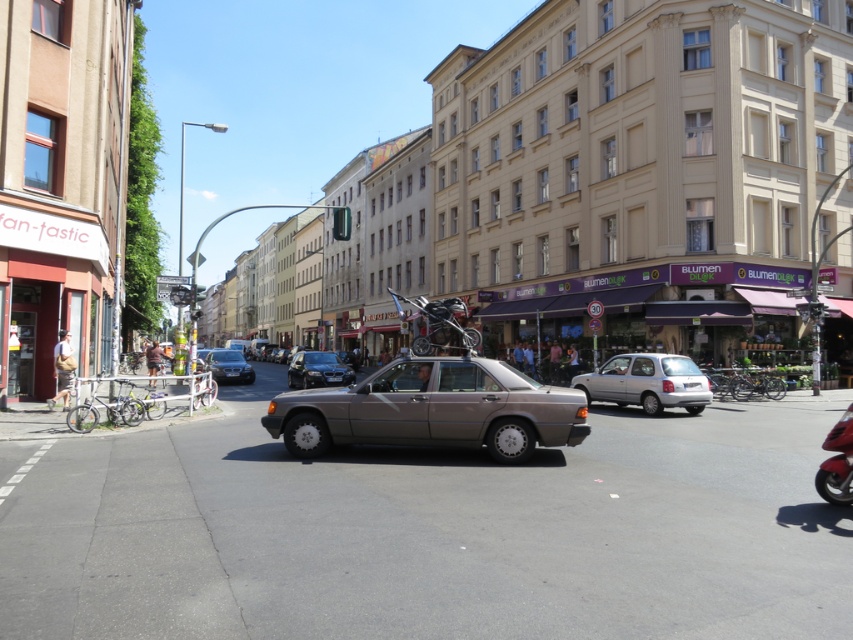
You are a delivery driver needing to park your satin silver car at center near the sidewalk on the left. Based on the scene, can you safely park the car there without blocking the sidewalk or the road?

The satin silver car at center is located at point (432, 410), which is in the center of the road. Parking there would block the road, so it is not safe to park the car there near the sidewalk on the left.

Consider the image. You are standing on the sidewalk in the urban street scene. You notice two points marked in the image. The first point is at coordinates point (x=830, y=499) and the second is at point (x=294, y=368). Which point is closer to you?

Point (x=830, y=499) is closer to the camera than point (x=294, y=368), so the first point is closer to you.